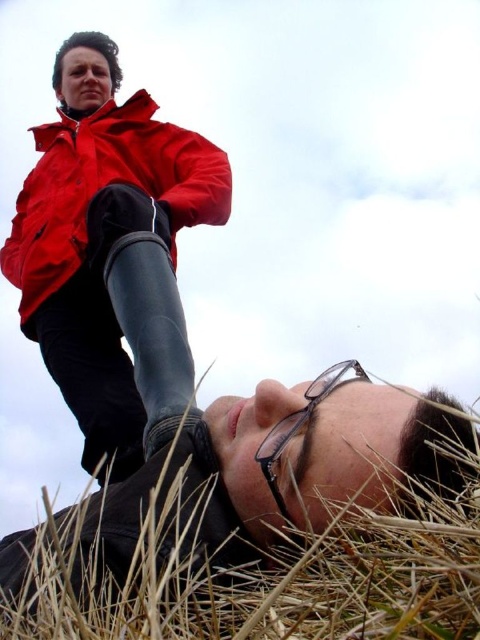
You are a photographer trying to capture the transparent plastic glasses at lower center in your shot. The brown dry grass at lower center might block the view. Is the grass in front of or behind the glasses?

The brown dry grass at lower center is located below transparent plastic glasses at lower center, meaning the grass is behind the glasses and won

Please provide the 2D coordinates of the brown dry grass at lower center in the image. The coordinates should be in the format of a point with two decimal places, like this example format point 0.000, 0.000. The scene is viewed from a low angle, showing a person standing in a bright red jacket and another lying on the grass. The grass is dry and golden brown, located at the lower center of the image.

The brown dry grass at lower center is located at point (x=192, y=497).

You are standing in the scene and want to place a small flag at the point closer to the camera. Which point should you choose between point (151, 150) and point (276, 444)?

Point (151, 150) is further to the camera than point (276, 444). Therefore, you should choose point (151, 150) to place the flag since it is closer to the camera.